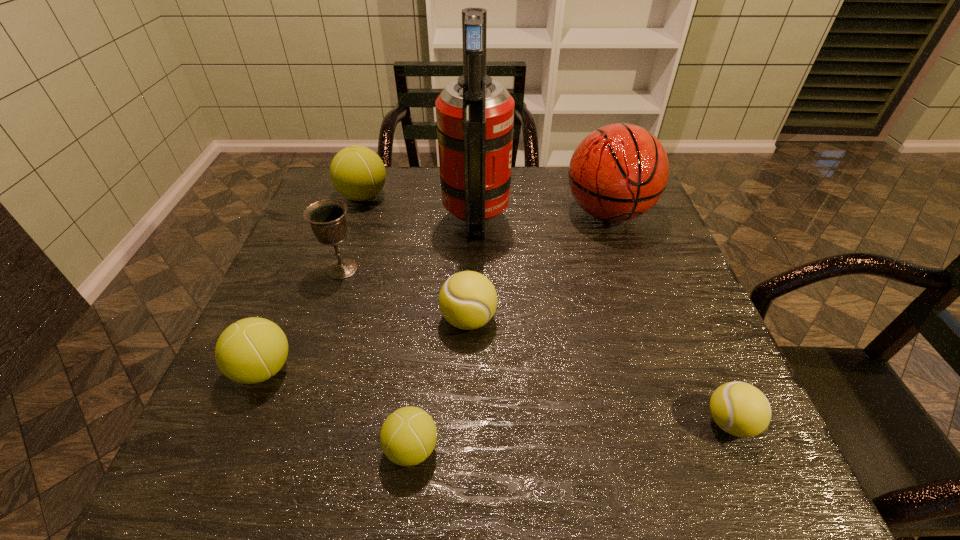
The height and width of the screenshot is (540, 960). I want to click on vacant space in between the smallest green tennis ball and the nearer yellow tennis ball, so click(x=570, y=435).

I want to click on free space between the second tallest object and the right yellow tennis ball, so [668, 318].

Identify the location of free area in between the smaller yellow tennis ball and the fourth farthest object. (536, 346).

Where is `empty location between the farther yellow tennis ball and the fire extinguisher`? The width and height of the screenshot is (960, 540). empty location between the farther yellow tennis ball and the fire extinguisher is located at coordinates (472, 268).

In order to click on unoccupied position between the fire extinguisher and the fifth nearest object in this screenshot , I will do `click(409, 242)`.

At what (x,y) coordinates should I click in order to perform the action: click on free space between the fifth nearest object and the tallest tennis ball. Please return your answer as a coordinate pair (x, y). The width and height of the screenshot is (960, 540). Looking at the image, I should click on (352, 233).

Identify the location of the fifth closest object relative to the rightmost green tennis ball. The width and height of the screenshot is (960, 540). (475, 114).

Identify the location of object that is the third closest to the chalice. This screenshot has height=540, width=960. (358, 173).

You are a GUI agent. You are given a task and a screenshot of the screen. Output one action in this format:
    pyautogui.click(x=<x>, y=<y>)
    Task: Click on the tennis ball that is the second closest to the red fire extinguisher
    This screenshot has width=960, height=540.
    Given the screenshot: What is the action you would take?
    pyautogui.click(x=358, y=173)

Locate an element on the screen. The height and width of the screenshot is (540, 960). the fourth closest tennis ball to the basketball is located at coordinates (408, 436).